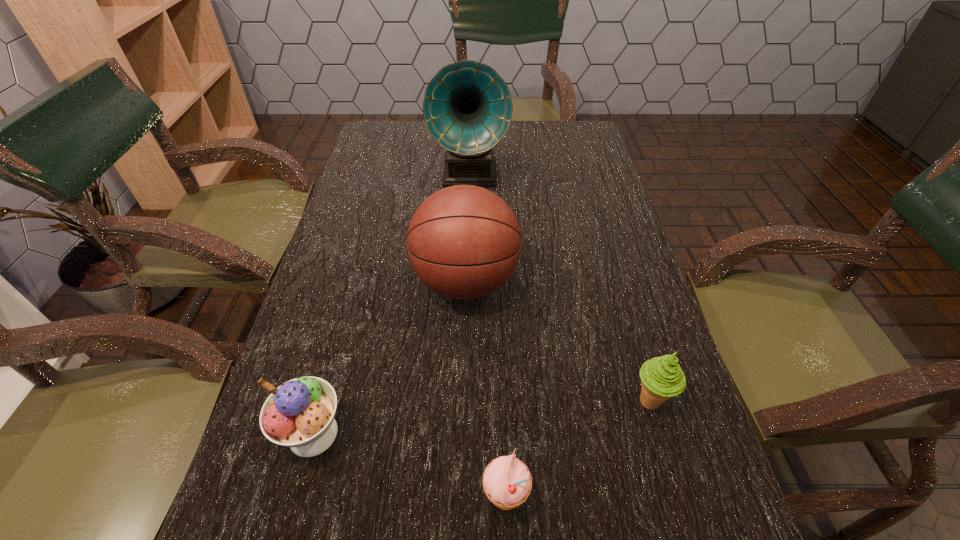
Where is `unoccupied position between the nearest object and the second farthest object`? Image resolution: width=960 pixels, height=540 pixels. unoccupied position between the nearest object and the second farthest object is located at coordinates (486, 391).

At what (x,y) coordinates should I click in order to perform the action: click on free space between the rightmost icecream and the leftmost object. Please return your answer as a coordinate pair (x, y). The image size is (960, 540). Looking at the image, I should click on [x=481, y=417].

Where is `unoccupied area between the leftmost object and the fourth nearest object`? Image resolution: width=960 pixels, height=540 pixels. unoccupied area between the leftmost object and the fourth nearest object is located at coordinates (390, 358).

Locate an element on the screen. The height and width of the screenshot is (540, 960). vacant space that's between the rightmost icecream and the nearest icecream is located at coordinates (577, 451).

Locate an element on the screen. The width and height of the screenshot is (960, 540). empty space that is in between the second farthest object and the leftmost object is located at coordinates (390, 358).

Locate an element on the screen. vacant area between the rightmost object and the leftmost icecream is located at coordinates (481, 417).

Find the location of `vacant area between the rightmost icecream and the second icecream from right to left`. vacant area between the rightmost icecream and the second icecream from right to left is located at coordinates (577, 451).

The height and width of the screenshot is (540, 960). Find the location of `unoccupied position between the leftmost object and the farthest object`. unoccupied position between the leftmost object and the farthest object is located at coordinates (392, 304).

Locate an element on the screen. The image size is (960, 540). blank region between the second icecream from left to right and the phonograph_record is located at coordinates point(488,338).

Identify which object is the fourth nearest to the tallest object. Please provide its 2D coordinates. Your answer should be formatted as a tuple, i.e. [(x, y)], where the tuple contains the x and y coordinates of a point satisfying the conditions above.

[(507, 482)]